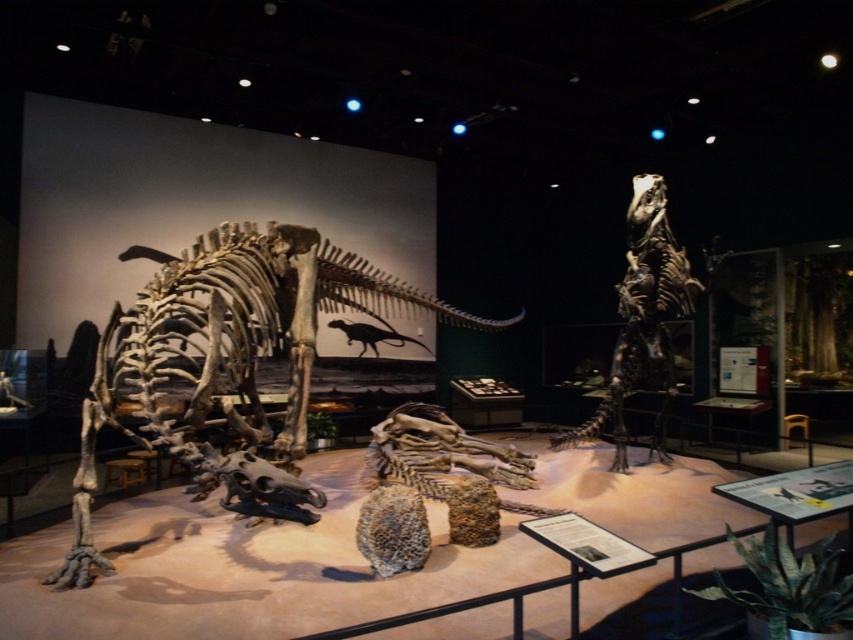
Is bone-like skeleton at left wider than shiny metallic dinosaur at center?

No.

Is point (169, 337) less distant than point (635, 243)?

That is True.

Does point (293, 436) come behind point (640, 340)?

No, it is not.

Identify the location of bone-like skeleton at left. (222, 352).